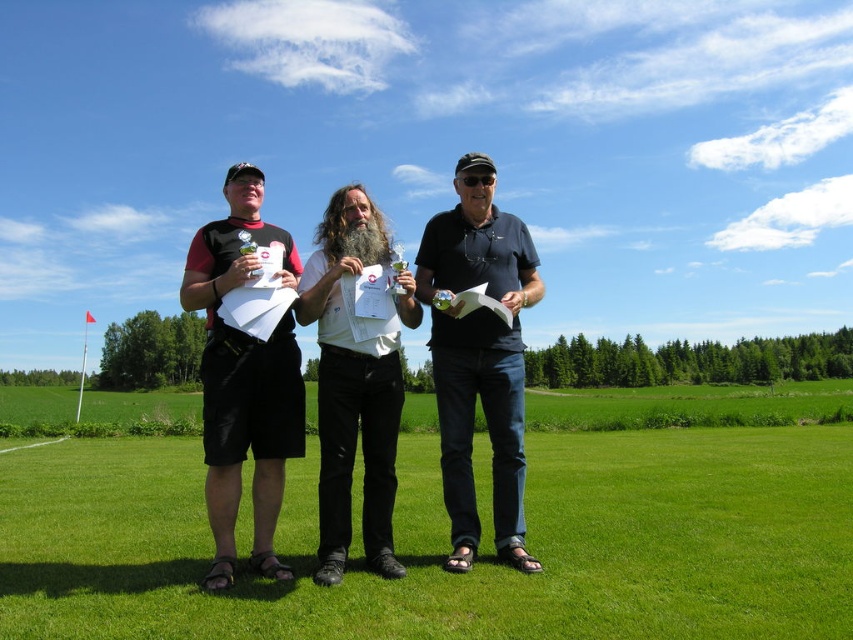
Question: Which object appears farthest from the camera in this image?

Choices:
 (A) black matte shorts at left
 (B) white paper at center

Answer: (B)

Question: Can you confirm if green grass at center is positioned to the left of white paper at center?

Choices:
 (A) yes
 (B) no

Answer: (B)

Question: Which object is positioned farthest from the dark blue polo shirt at center?

Choices:
 (A) matte black shorts at center
 (B) black matte shorts at left

Answer: (B)

Question: Does green grass at center come in front of white paper at center?

Choices:
 (A) yes
 (B) no

Answer: (A)

Question: Where is green grass at center located in relation to matte black shorts at center in the image?

Choices:
 (A) right
 (B) left

Answer: (B)

Question: Among these objects, which one is nearest to the camera?

Choices:
 (A) white paper at center
 (B) dark blue polo shirt at center
 (C) green grass at center

Answer: (C)